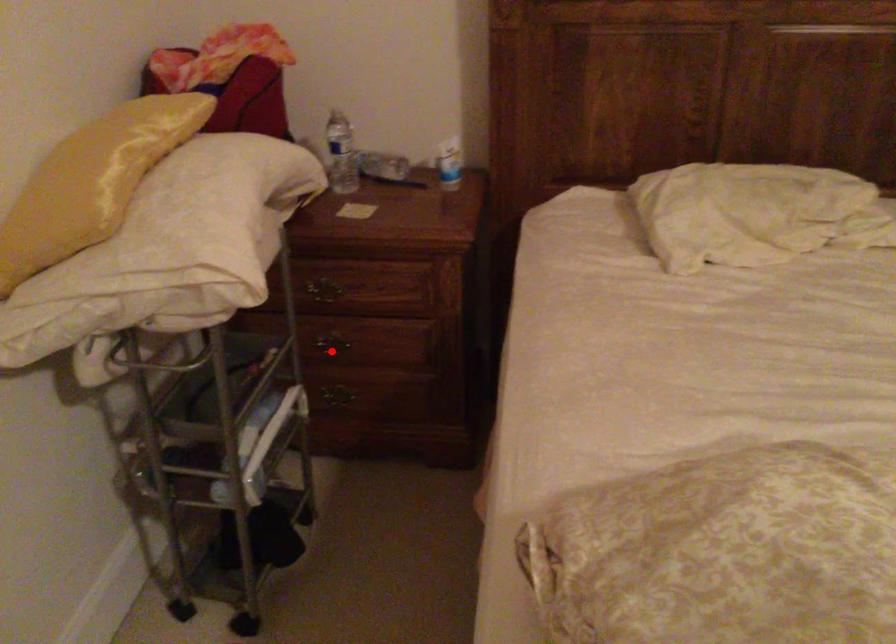
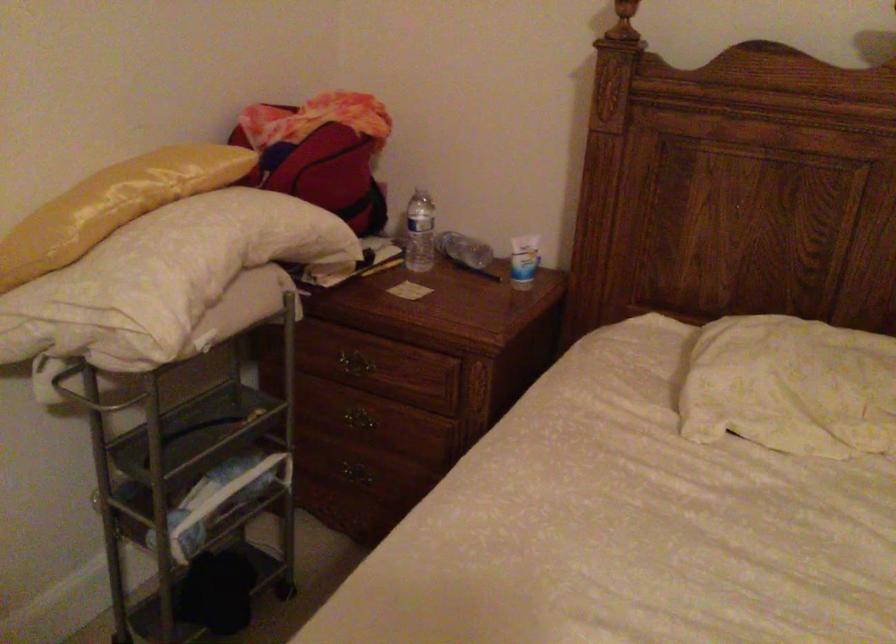
Find the pixel in the second image that matches the highlighted location in the first image.

(357, 426)